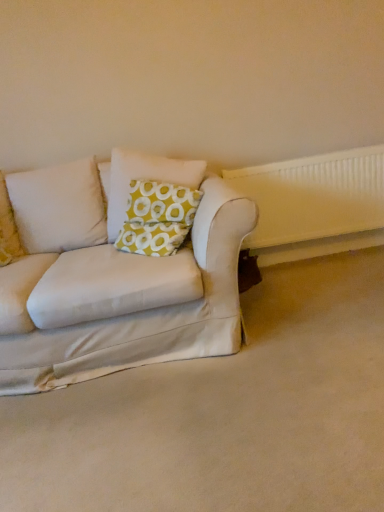
Question: Does white fabric couch at lower left come behind yellow-green fabric pillow at center?

Choices:
 (A) yes
 (B) no

Answer: (B)

Question: From the image's perspective, is white fabric couch at lower left located beneath yellow-green fabric pillow at center?

Choices:
 (A) yes
 (B) no

Answer: (A)

Question: Considering the relative positions of white fabric couch at lower left and yellow-green fabric pillow at center in the image provided, is white fabric couch at lower left to the right of yellow-green fabric pillow at center from the viewer's perspective?

Choices:
 (A) no
 (B) yes

Answer: (B)

Question: Does white fabric couch at lower left have a lesser height compared to yellow-green fabric pillow at center?

Choices:
 (A) yes
 (B) no

Answer: (A)

Question: Is white fabric couch at lower left wider than yellow-green fabric pillow at center?

Choices:
 (A) no
 (B) yes

Answer: (B)

Question: Can you confirm if white fabric couch at lower left is bigger than yellow-green fabric pillow at center?

Choices:
 (A) no
 (B) yes

Answer: (B)

Question: Is yellow-green fabric pillow at center not near white plastic radiator at right?

Choices:
 (A) no
 (B) yes

Answer: (A)

Question: Considering the relative sizes of yellow-green fabric pillow at center and white plastic radiator at right in the image provided, is yellow-green fabric pillow at center wider than white plastic radiator at right?

Choices:
 (A) yes
 (B) no

Answer: (A)

Question: Is yellow-green fabric pillow at center aimed at white plastic radiator at right?

Choices:
 (A) yes
 (B) no

Answer: (B)

Question: Is yellow-green fabric pillow at center taller than white plastic radiator at right?

Choices:
 (A) no
 (B) yes

Answer: (A)

Question: Does yellow-green fabric pillow at center have a lesser width compared to white plastic radiator at right?

Choices:
 (A) yes
 (B) no

Answer: (B)

Question: Does yellow-green fabric pillow at center contain white plastic radiator at right?

Choices:
 (A) no
 (B) yes

Answer: (A)

Question: Does white plastic radiator at right appear on the left side of white fabric couch at lower left?

Choices:
 (A) yes
 (B) no

Answer: (B)